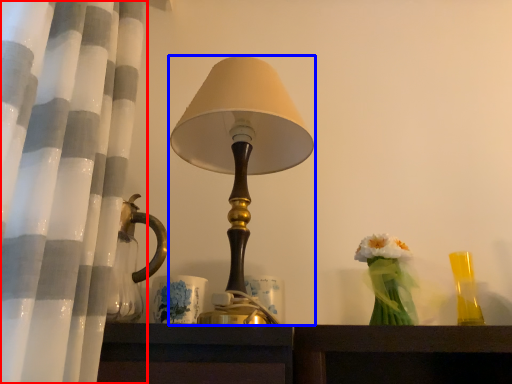
Question: Which point is closer to the camera, curtain (highlighted by a red box) or lamp (highlighted by a blue box)?

Choices:
 (A) curtain
 (B) lamp

Answer: (A)